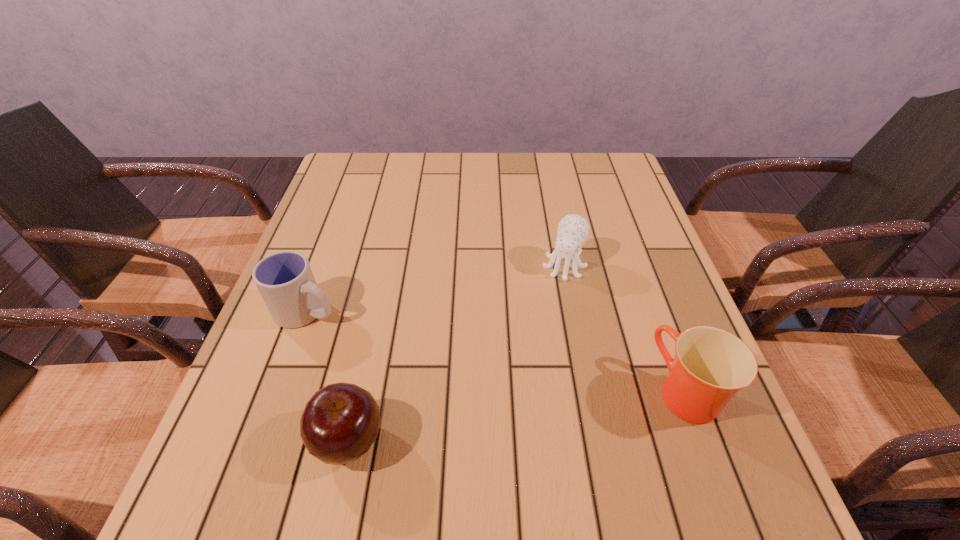
I want to click on vacant space on the desktop that is between the apple and the rightmost object and is positioned with the handle on the side of the left cup, so click(516, 416).

You are a GUI agent. You are given a task and a screenshot of the screen. Output one action in this format:
    pyautogui.click(x=<x>, y=<y>)
    Task: Click on the free space on the desktop that is between the third object from right to left and the right cup and is positioned on the front-facing side of the second object from right to left
    
    Given the screenshot: What is the action you would take?
    pyautogui.click(x=492, y=420)